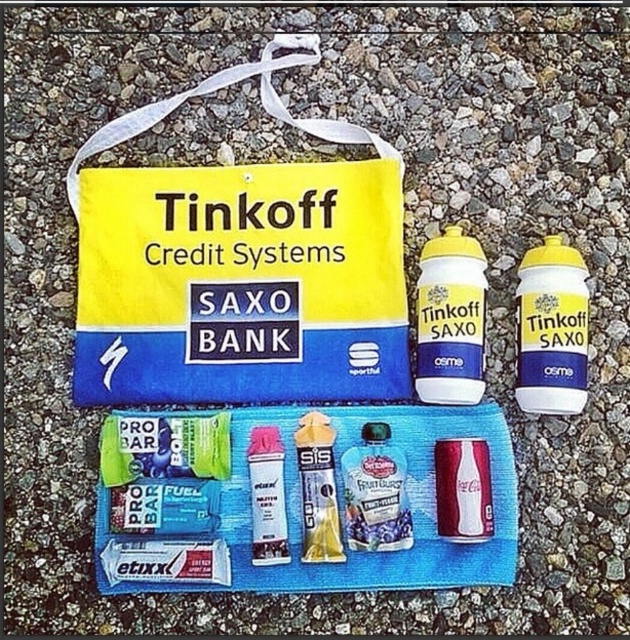
You are a photographer setting up a shot of the yellow matte bottle at center and the metallic silver can at center. Which object should you focus on first if you want to capture both in sharp focus?

The yellow matte bottle at center is further to the viewer than the metallic silver can at center, so you should focus on the yellow matte bottle at center first to ensure both are in sharp focus.

You are standing in front of a cycling gear display. You see a green matte bar at lower left. Can you reach it without moving your feet?

The green matte bar at lower left is 1.13 meters from the viewer. Since the average arm length is about 0.7 meters, you cannot reach it without moving your feet.